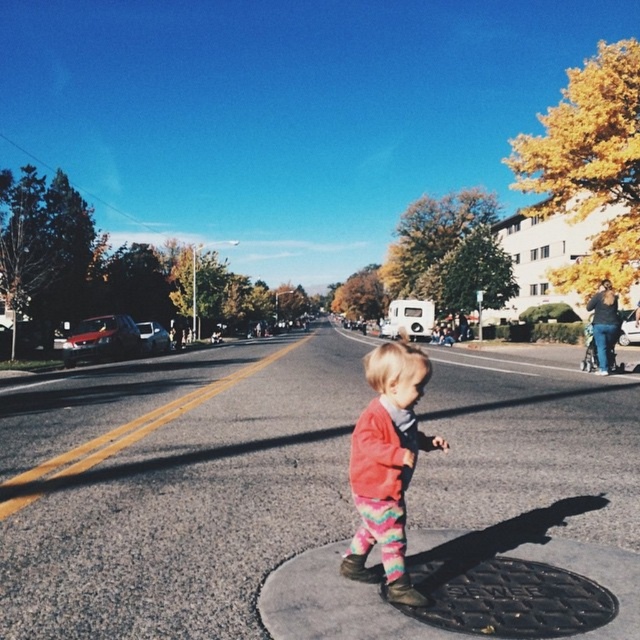
Question: Is red sweater at center smaller than black textured manhole cover at center?

Choices:
 (A) no
 (B) yes

Answer: (A)

Question: Which point appears farthest from the camera in this image?

Choices:
 (A) (508, 596)
 (B) (426, 442)

Answer: (B)

Question: Does red sweater at center come in front of black textured manhole cover at center?

Choices:
 (A) no
 (B) yes

Answer: (A)

Question: Which of the following is the farthest from the observer?

Choices:
 (A) red sweater at center
 (B) black textured manhole cover at center

Answer: (A)

Question: Is red sweater at center bigger than black textured manhole cover at center?

Choices:
 (A) yes
 (B) no

Answer: (A)